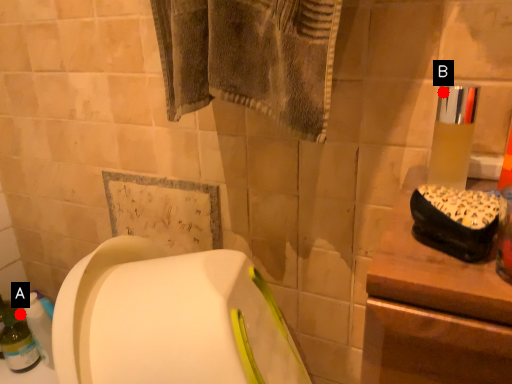
Question: Two points are circled on the image, labeled by A and B beside each circle. Which point is farther from the camera taking this photo?

Choices:
 (A) A is further
 (B) B is further

Answer: (A)